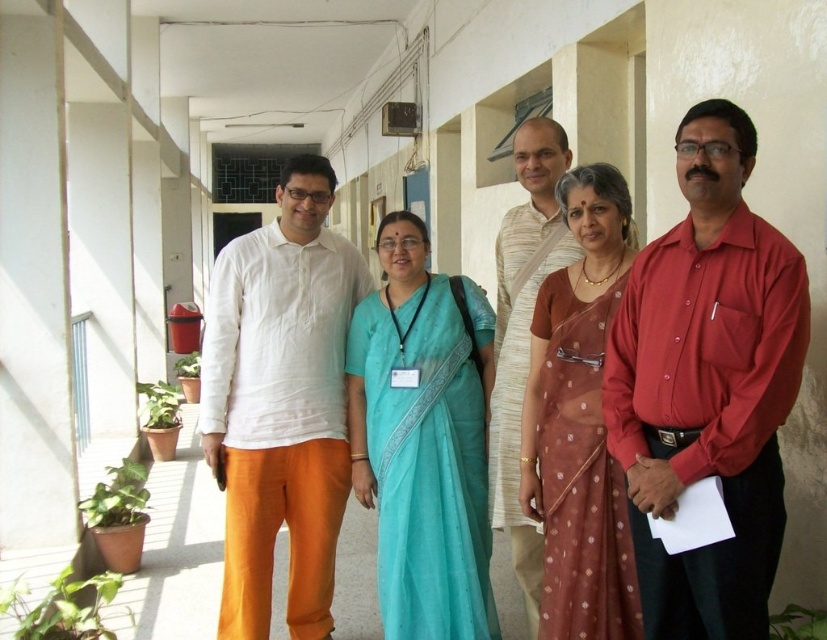
Question: Can you confirm if white cotton shirt at center is positioned below brown sheer saree at center?

Choices:
 (A) no
 (B) yes

Answer: (A)

Question: Which point appears farthest from the camera in this image?

Choices:
 (A) (242, 531)
 (B) (429, 387)

Answer: (A)

Question: Which object is positioned closest to the brown sheer saree at center?

Choices:
 (A) light beige cotton shirt at center
 (B) white cotton shirt at center
 (C) teal silk saree at center
 (D) shiny red shirt at right

Answer: (A)

Question: Considering the relative positions of shiny red shirt at right and light beige cotton shirt at center in the image provided, where is shiny red shirt at right located with respect to light beige cotton shirt at center?

Choices:
 (A) right
 (B) left

Answer: (A)

Question: Which of the following is the closest to the observer?

Choices:
 (A) shiny red shirt at right
 (B) light beige cotton shirt at center

Answer: (A)

Question: Does white cotton shirt at center appear on the right side of teal silk saree at center?

Choices:
 (A) no
 (B) yes

Answer: (A)